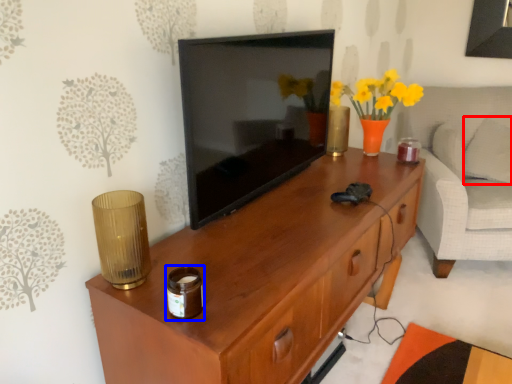
Question: Which object is closer to the camera taking this photo, pillow (highlighted by a red box) or candle holder (highlighted by a blue box)?

Choices:
 (A) pillow
 (B) candle holder

Answer: (B)